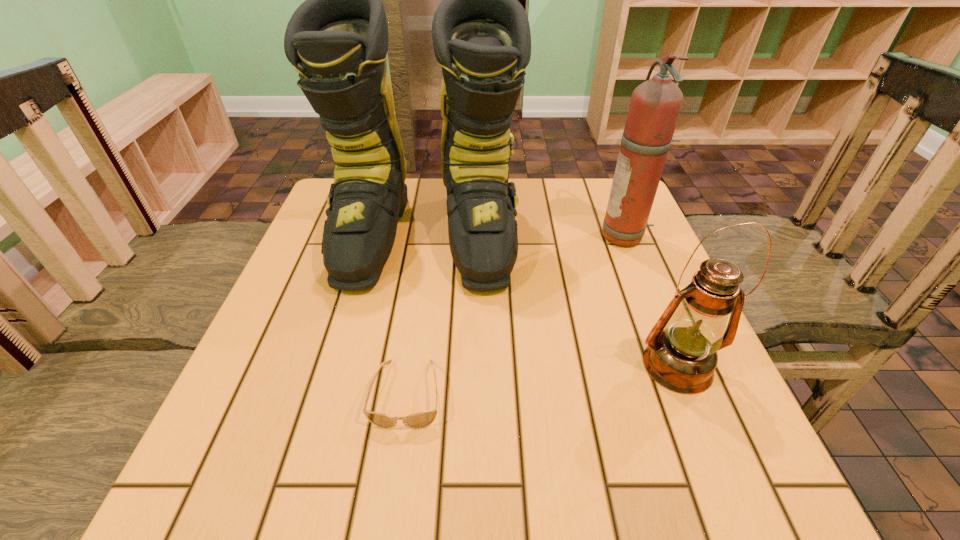
Image resolution: width=960 pixels, height=540 pixels. In the image, there is a desktop. In order to click on vacant region at the near left corner in this screenshot , I will do `click(280, 505)`.

Where is `unoccupied area between the third shortest object and the ski boots`? unoccupied area between the third shortest object and the ski boots is located at coordinates (525, 237).

Locate an element on the screen. The image size is (960, 540). vacant area between the fire extinguisher and the oil lamp is located at coordinates (652, 301).

Locate an element on the screen. free space between the ski boots and the second tallest object is located at coordinates (525, 237).

I want to click on vacant area between the oil lamp and the sunglasses, so click(542, 380).

This screenshot has width=960, height=540. In order to click on vacant region between the sunglasses and the fire extinguisher in this screenshot , I will do `click(516, 315)`.

You are a GUI agent. You are given a task and a screenshot of the screen. Output one action in this format:
    pyautogui.click(x=<x>, y=<y>)
    Task: Click on the unoccupied position between the third shortest object and the oil lamp
    The image size is (960, 540).
    Given the screenshot: What is the action you would take?
    pyautogui.click(x=652, y=301)

Where is `free space between the fire extinguisher and the second shortest object`? Image resolution: width=960 pixels, height=540 pixels. free space between the fire extinguisher and the second shortest object is located at coordinates (652, 301).

The height and width of the screenshot is (540, 960). Find the location of `vacant region between the third tallest object and the sunglasses`. vacant region between the third tallest object and the sunglasses is located at coordinates (542, 380).

You are a GUI agent. You are given a task and a screenshot of the screen. Output one action in this format:
    pyautogui.click(x=<x>, y=<y>)
    Task: Click on the empty location between the third shortest object and the oil lamp
    
    Given the screenshot: What is the action you would take?
    pyautogui.click(x=652, y=301)